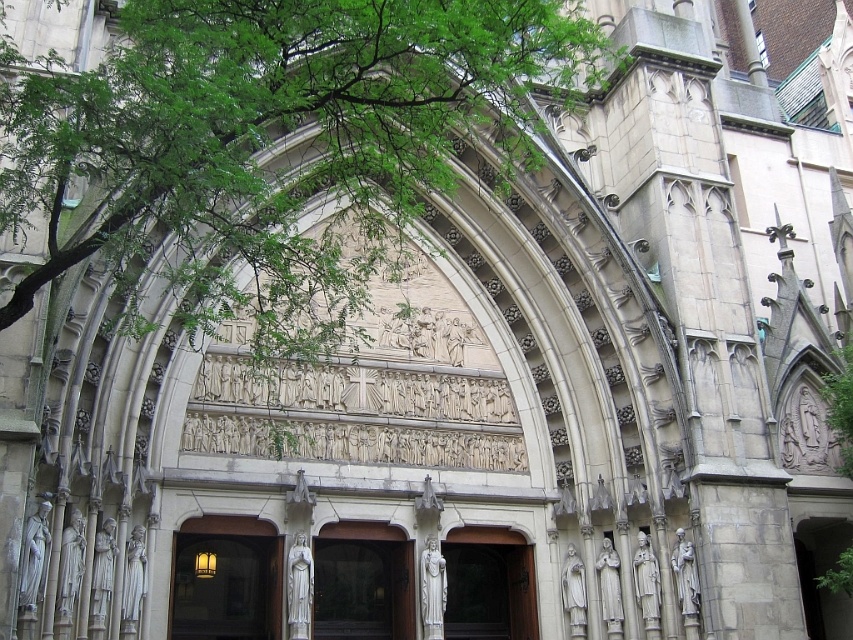
Question: Among these objects, which one is farthest from the camera?

Choices:
 (A) smooth stone archway at center
 (B) white stone arch at center
 (C) green leafy tree at upper left

Answer: (B)

Question: Is smooth stone archway at center to the right of white stone arch at center from the viewer's perspective?

Choices:
 (A) yes
 (B) no

Answer: (B)

Question: Which object is the farthest from the green leafy tree at upper left?

Choices:
 (A) smooth stone archway at center
 (B) white stone arch at center

Answer: (B)

Question: Is smooth stone archway at center below white stone arch at center?

Choices:
 (A) no
 (B) yes

Answer: (A)

Question: Does green leafy tree at upper left appear on the right side of white stone arch at center?

Choices:
 (A) no
 (B) yes

Answer: (A)

Question: Which of these objects is positioned closest to the white stone arch at center?

Choices:
 (A) green leafy tree at upper left
 (B) smooth stone archway at center

Answer: (B)